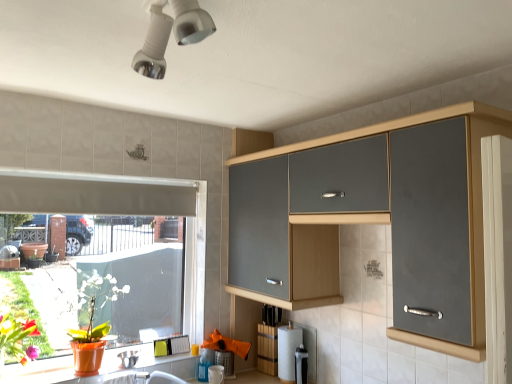
Locate an element on the screen. The image size is (512, 384). vacant region above white matte exhaust hood at left (from a real-world perspective) is located at coordinates (108, 183).